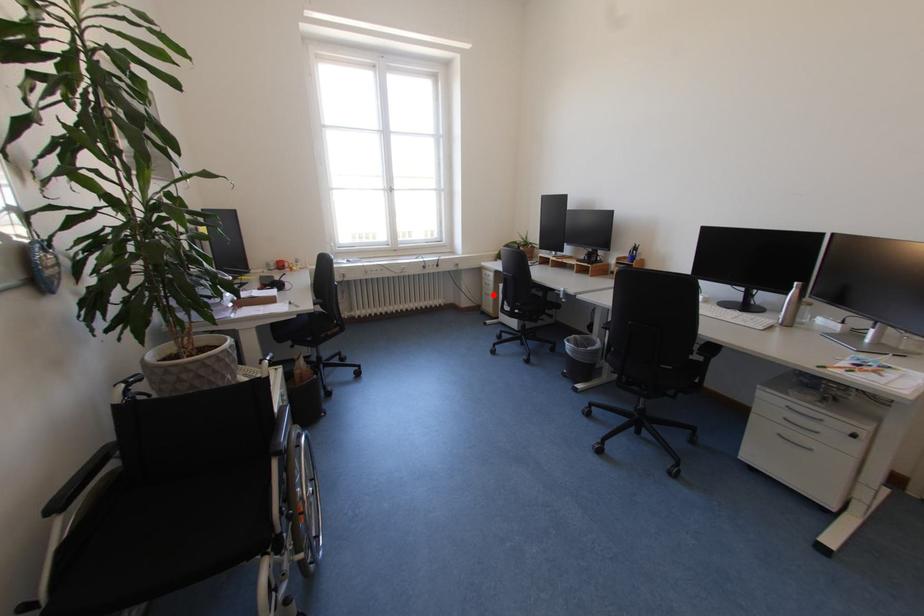
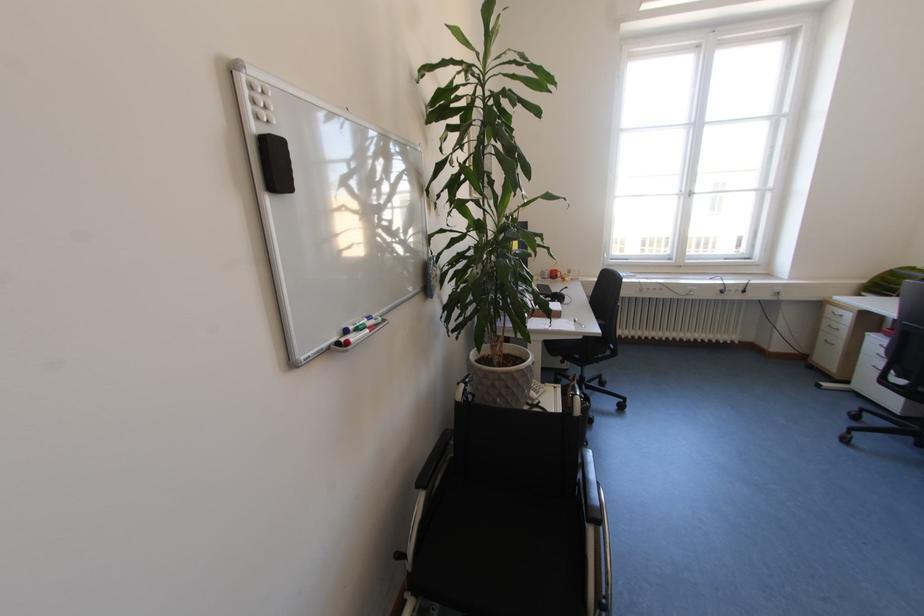
Locate, in the second image, the point that corresponds to the highlighted location in the first image.

(833, 342)